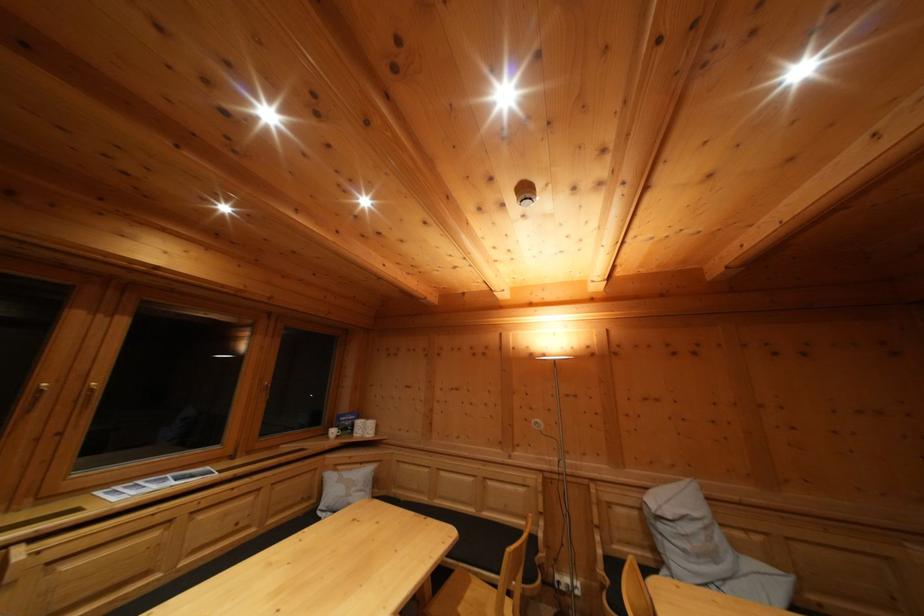
Which object does [152,484] point to?

This point indicates the small booklet.